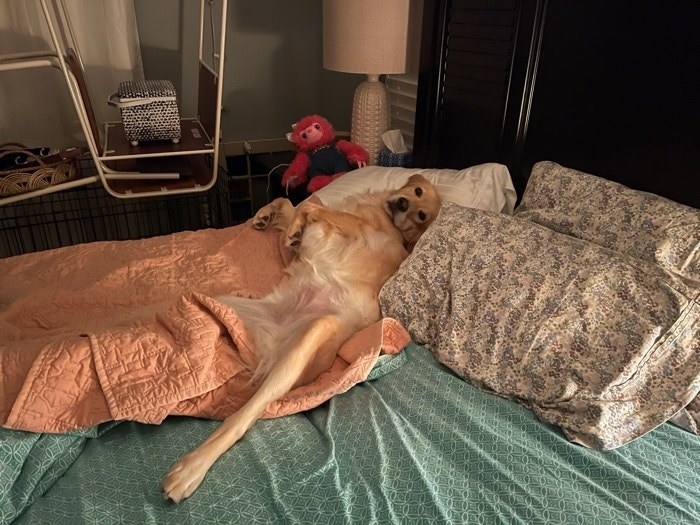
Locate an element on the screen. This screenshot has width=700, height=525. paisley pattern pillow is located at coordinates (526, 285), (595, 211).